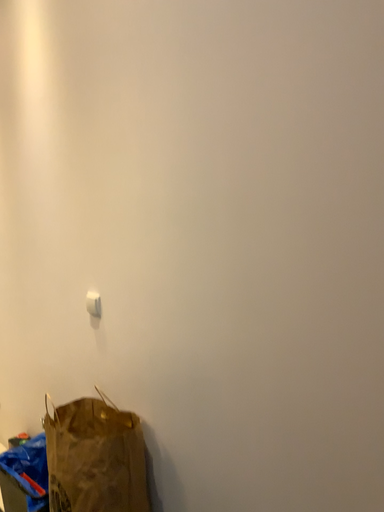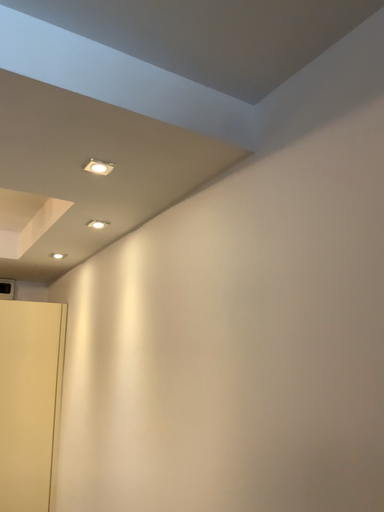
Question: How did the camera likely rotate when shooting the video?

Choices:
 (A) rotated upward
 (B) rotated downward

Answer: (A)